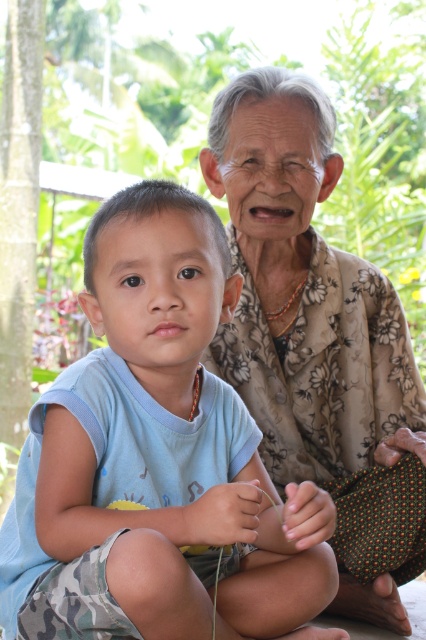
How far apart are blue cotton shirt at center and floral-patterned fabric at upper right?

blue cotton shirt at center is 60.72 centimeters away from floral-patterned fabric at upper right.

Measure the distance between point [226,496] and camera.

Point [226,496] is 1.15 meters away from camera.

Where is `blue cotton shirt at center`? blue cotton shirt at center is located at coordinates (x=157, y=460).